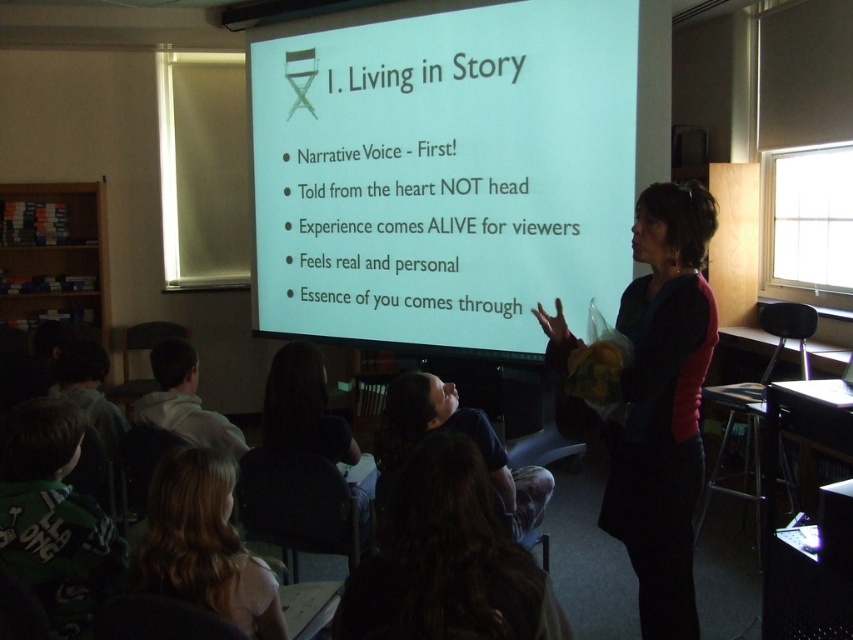
Can you confirm if dark blue sweater at center is taller than dark brown hair at lower center?

Yes.

Is dark blue sweater at center to the left of dark brown hair at lower center from the viewer's perspective?

No, dark blue sweater at center is not to the left of dark brown hair at lower center.

Between point (640, 596) and point (421, 600), which one is positioned behind?

Positioned behind is point (640, 596).

This screenshot has width=853, height=640. I want to click on dark blue sweater at center, so click(x=651, y=401).

Can you confirm if dark blue sweater at center is shorter than blonde hair at lower left?

Incorrect, dark blue sweater at center's height does not fall short of blonde hair at lower left's.

Image resolution: width=853 pixels, height=640 pixels. In order to click on dark blue sweater at center in this screenshot , I will do `click(651, 401)`.

Does dark hair at lower center have a lesser height compared to blonde hair at lower left?

Incorrect, dark hair at lower center's height does not fall short of blonde hair at lower left's.

Which is in front, point (268, 428) or point (161, 484)?

Point (161, 484)

Identify the location of dark hair at lower center. (303, 464).